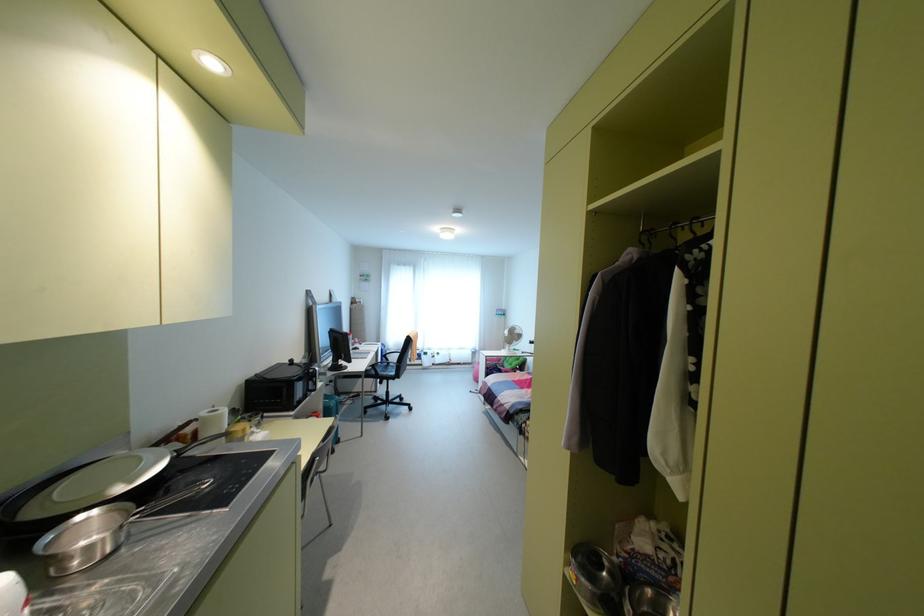
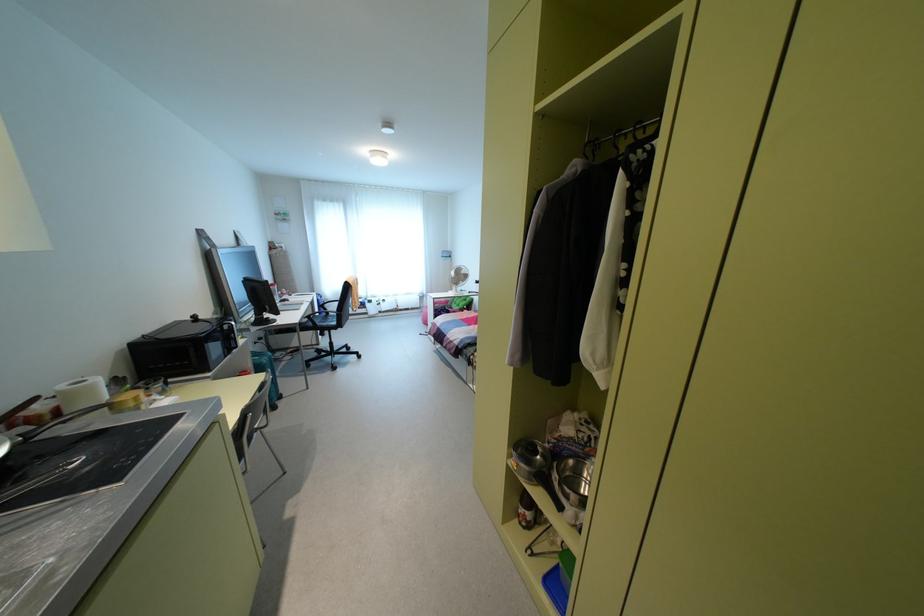
Where in the second image is the point corresponding to point 609,575 from the first image?

(541, 456)